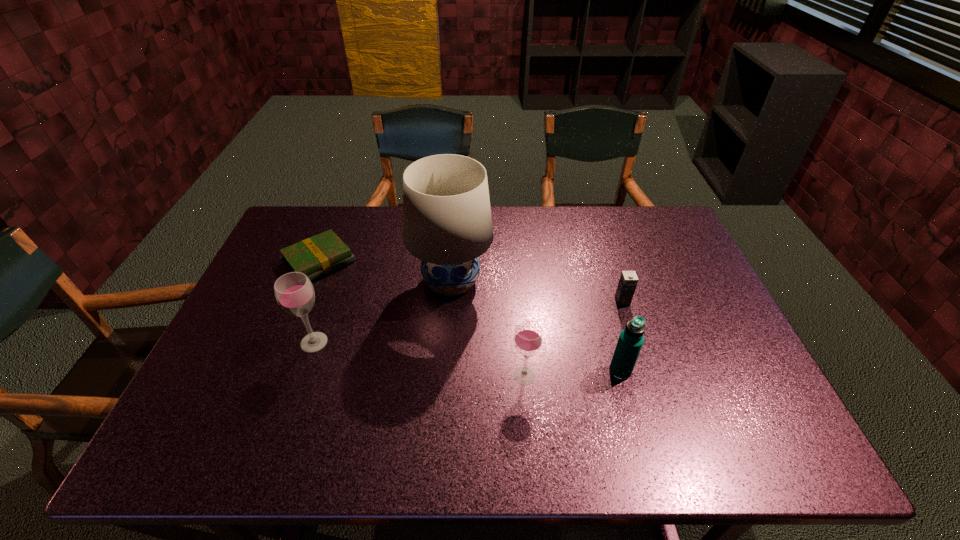
Please point a vacant point for placing a wineglass on the right. Please provide its 2D coordinates. Your answer should be formatted as a tuple, i.e. [(x, y)], where the tuple contains the x and y coordinates of a point satisfying the conditions above.

[(767, 415)]